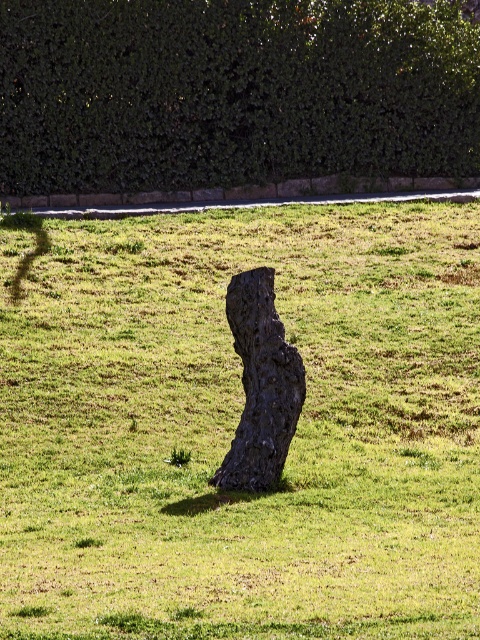
Question: Is dark brown textured tree stump at center in front of dark bark tree trunk at center?

Choices:
 (A) yes
 (B) no

Answer: (A)

Question: Estimate the real-world distances between objects in this image. Which object is closer to the dark bark tree trunk at center?

Choices:
 (A) dark brown textured tree stump at center
 (B) green leafy hedge at upper center

Answer: (A)

Question: Can you confirm if dark brown textured tree stump at center is wider than green leafy hedge at upper center?

Choices:
 (A) no
 (B) yes

Answer: (B)

Question: Estimate the real-world distances between objects in this image. Which object is closer to the dark bark tree trunk at center?

Choices:
 (A) green leafy hedge at upper center
 (B) dark brown textured tree stump at center

Answer: (B)

Question: Is dark brown textured tree stump at center wider than dark bark tree trunk at center?

Choices:
 (A) no
 (B) yes

Answer: (B)

Question: Which is nearer to the dark brown textured tree stump at center?

Choices:
 (A) green leafy hedge at upper center
 (B) dark bark tree trunk at center

Answer: (B)